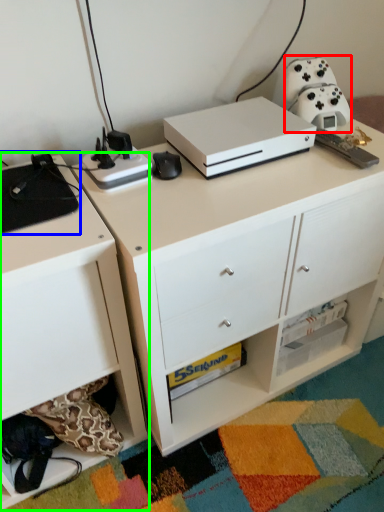
Question: Considering the real-world distances, which object is farthest from appliance (highlighted by a red box)? appliance (highlighted by a blue box) or chest of drawers (highlighted by a green box)?

Choices:
 (A) appliance
 (B) chest of drawers

Answer: (B)